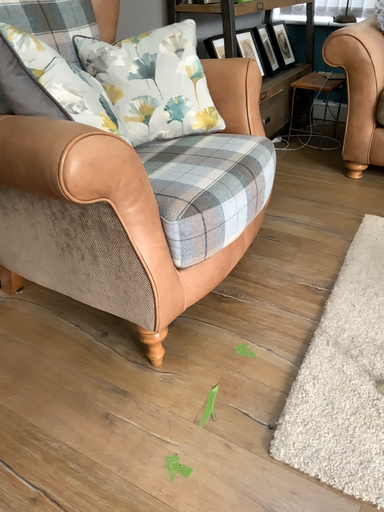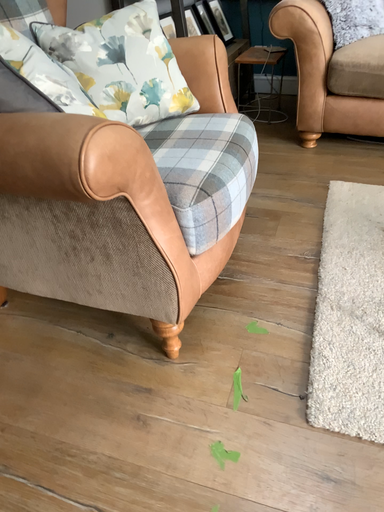
Question: Which way did the camera rotate in the video?

Choices:
 (A) rotated left
 (B) rotated right

Answer: (B)